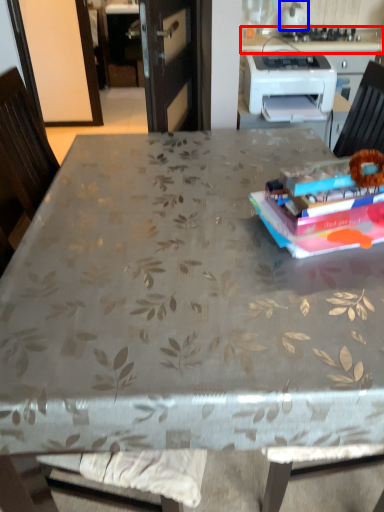
Question: Which object appears farthest to the camera in this image, counter top (highlighted by a red box) or kitchen appliance (highlighted by a blue box)?

Choices:
 (A) counter top
 (B) kitchen appliance

Answer: (B)